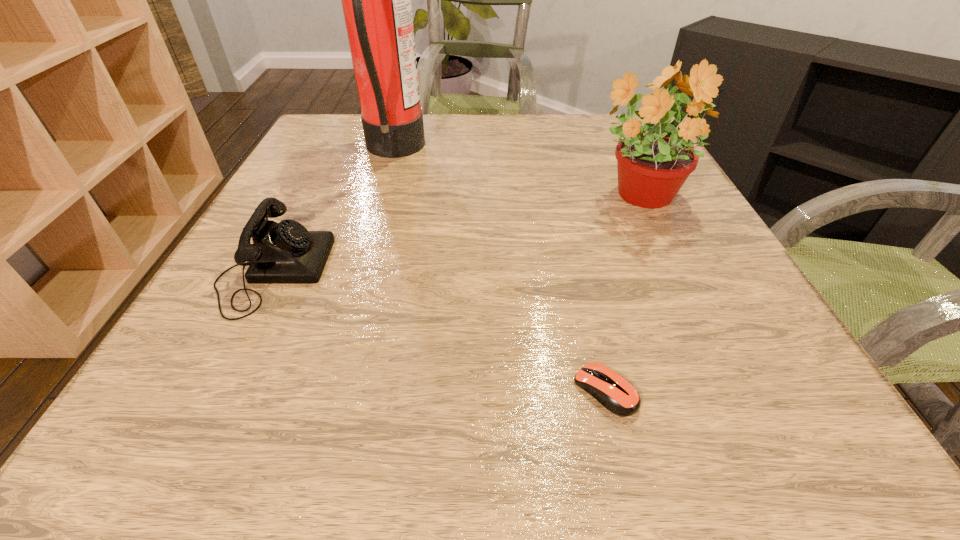
Identify the location of free space at the right edge of the desktop. Image resolution: width=960 pixels, height=540 pixels. (708, 305).

Find the location of a particular element. The width and height of the screenshot is (960, 540). vacant space at the far left corner of the desktop is located at coordinates (313, 146).

Image resolution: width=960 pixels, height=540 pixels. Identify the location of free space at the far right corner of the desktop. coord(583,118).

This screenshot has width=960, height=540. In order to click on vacant position at the near right corner of the desktop in this screenshot , I will do `click(827, 438)`.

The height and width of the screenshot is (540, 960). I want to click on free point between the nearest object and the tallest object, so click(x=499, y=271).

Locate an element on the screen. Image resolution: width=960 pixels, height=540 pixels. free area in between the third tallest object and the third shortest object is located at coordinates (455, 234).

Find the location of a particular element. The width and height of the screenshot is (960, 540). free space that is in between the second tallest object and the second object from right to left is located at coordinates (621, 293).

You are a GUI agent. You are given a task and a screenshot of the screen. Output one action in this format:
    pyautogui.click(x=<x>, y=<y>)
    Task: Click on the free space between the fire extinguisher and the second shortest object
    The height and width of the screenshot is (540, 960).
    Given the screenshot: What is the action you would take?
    pyautogui.click(x=333, y=211)

At what (x,y) coordinates should I click in order to perform the action: click on free space between the third object from left to right and the flowerpot. Please return your answer as a coordinate pair (x, y). The image size is (960, 540). Looking at the image, I should click on (621, 293).

Find the location of a particular element. The image size is (960, 540). free area in between the fire extinguisher and the third shortest object is located at coordinates (516, 174).